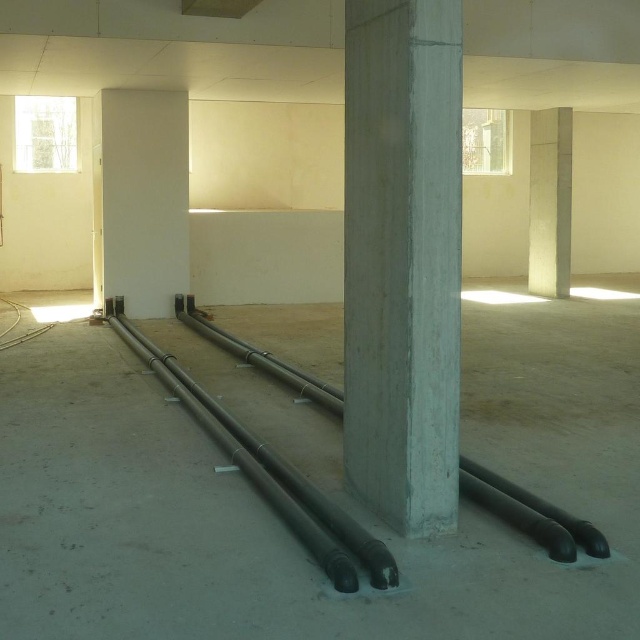
Question: Which object appears farthest from the camera in this image?

Choices:
 (A) concrete at center
 (B) black rubber pipe at center
 (C) black matte pipes at center

Answer: (C)

Question: Which object is positioned closest to the black rubber pipe at center?

Choices:
 (A) black matte pipes at center
 (B) concrete at center

Answer: (B)

Question: From the image, what is the correct spatial relationship of concrete at center in relation to black matte pipes at center?

Choices:
 (A) left
 (B) right

Answer: (A)

Question: Does black matte pipes at center appear under black rubber pipe at center?

Choices:
 (A) yes
 (B) no

Answer: (A)

Question: Which of these objects is positioned closest to the black rubber pipe at center?

Choices:
 (A) black matte pipes at center
 (B) smooth concrete pillar at center

Answer: (A)

Question: Is black matte pipes at center below black rubber pipe at center?

Choices:
 (A) no
 (B) yes

Answer: (B)